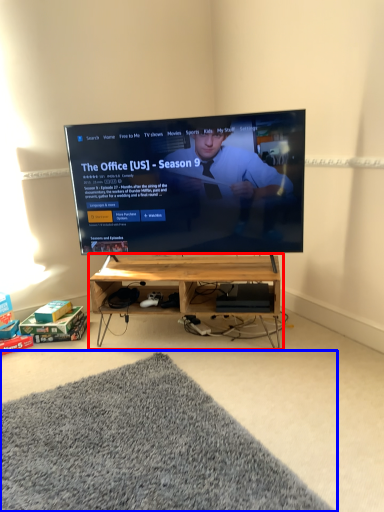
Question: Which of the following is the closest to the observer, shelf (highlighted by a red box) or mat (highlighted by a blue box)?

Choices:
 (A) shelf
 (B) mat

Answer: (B)